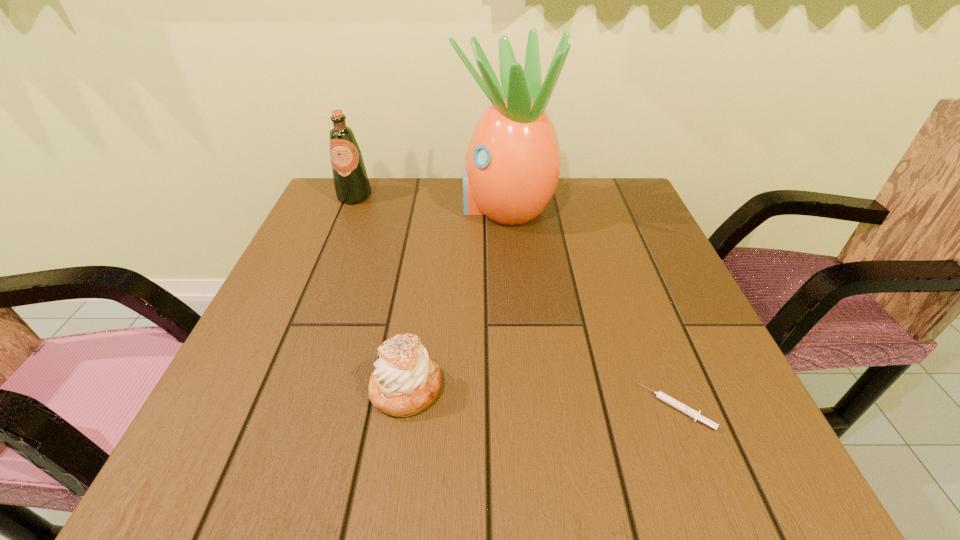
Find the location of a particular element. The image size is (960, 540). free point between the tallest object and the leftmost object is located at coordinates (430, 201).

What are the coordinates of `empty location between the pastry and the rightmost object` in the screenshot? It's located at (541, 398).

Locate an element on the screen. The width and height of the screenshot is (960, 540). free space between the olive oil and the second object from right to left is located at coordinates (430, 201).

Where is `vacant space that is in between the second shortest object and the syringe`? The height and width of the screenshot is (540, 960). vacant space that is in between the second shortest object and the syringe is located at coordinates (541, 398).

Locate an element on the screen. This screenshot has width=960, height=540. free spot between the third tallest object and the leftmost object is located at coordinates (380, 292).

The height and width of the screenshot is (540, 960). Identify the location of free spot between the third tallest object and the pineapple. (456, 298).

Choose which object is the nearest neighbor to the pastry. Please provide its 2D coordinates. Your answer should be formatted as a tuple, i.e. [(x, y)], where the tuple contains the x and y coordinates of a point satisfying the conditions above.

[(694, 414)]

I want to click on object that is the closest to the third tallest object, so click(694, 414).

You are a GUI agent. You are given a task and a screenshot of the screen. Output one action in this format:
    pyautogui.click(x=<x>, y=<y>)
    Task: Click on the vacant region that satisfies the following two spatial constraints: 1. on the front-facing side of the second tallest object; 2. on the right side of the pastry
    This screenshot has height=540, width=960.
    Given the screenshot: What is the action you would take?
    pyautogui.click(x=276, y=388)

Find the location of `free point that satisfies the following two spatial constraints: 1. on the front-facing side of the second object from left to right; 2. on the left side of the leftmost object`. free point that satisfies the following two spatial constraints: 1. on the front-facing side of the second object from left to right; 2. on the left side of the leftmost object is located at coordinates (276, 388).